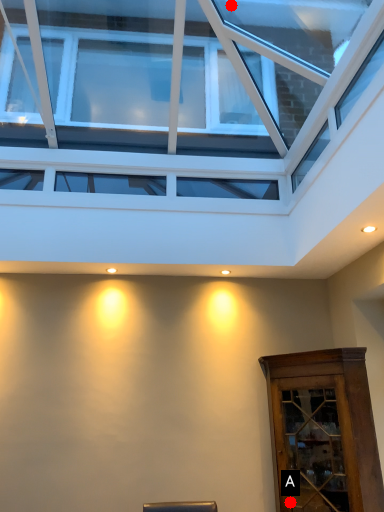
Question: Two points are circled on the image, labeled by A and B beside each circle. Which point appears farthest from the camera in this image?

Choices:
 (A) A is further
 (B) B is further

Answer: (B)